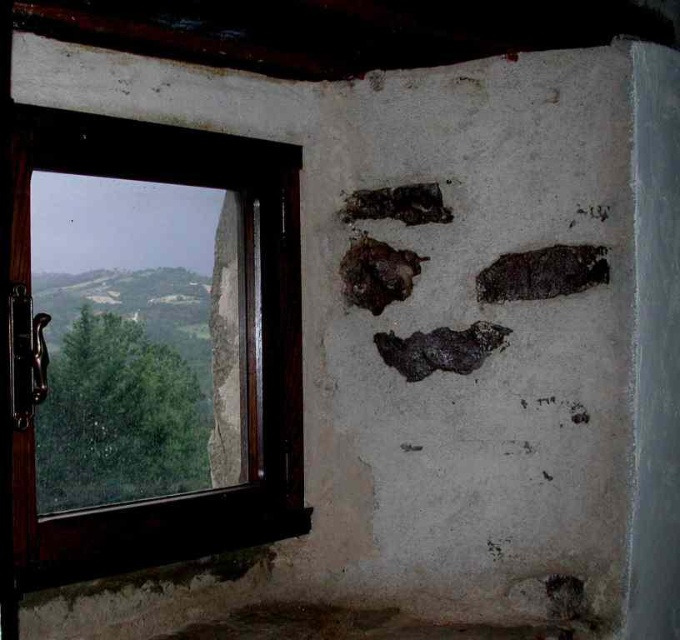
Question: Which of the following is the closest to the observer?

Choices:
 (A) (428, 212)
 (B) (545, 289)
 (C) (479, 324)
 (D) (390, 285)

Answer: (B)

Question: Is brown wooden window at left above brown rough rock at center?

Choices:
 (A) yes
 (B) no

Answer: (B)

Question: Which object is the closest to the dark textured rock at center?

Choices:
 (A) charcoal textured footprint at upper center
 (B) dark textured rock at upper right

Answer: (B)

Question: Is brown wooden window at left positioned in front of charcoal textured footprint at upper center?

Choices:
 (A) no
 (B) yes

Answer: (B)

Question: Which point appears closest to the camera in this image?

Choices:
 (A) (403, 344)
 (B) (20, 253)
 (C) (509, 262)
 (D) (411, 276)

Answer: (B)

Question: Can you confirm if brown rough rock at center is smaller than charcoal textured footprint at upper center?

Choices:
 (A) no
 (B) yes

Answer: (A)